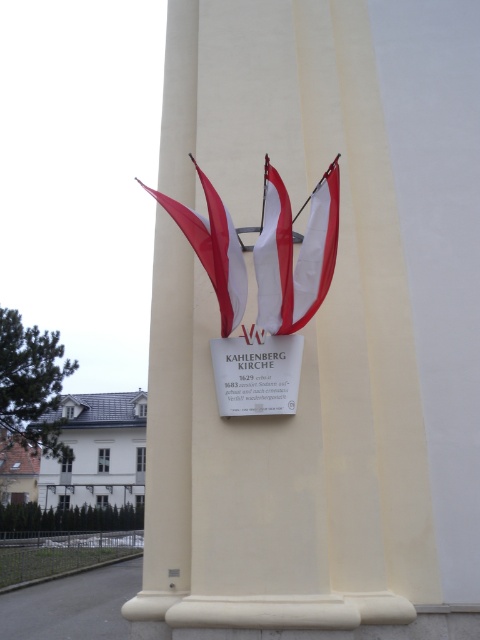
Question: Is white matte plaque at center to the right of white matte flag at center from the viewer's perspective?

Choices:
 (A) no
 (B) yes

Answer: (A)

Question: Considering the real-world distances, which object is farthest from the white/red striped flag at center?

Choices:
 (A) red fabric flag at center
 (B) white matte flag at center

Answer: (A)

Question: Is white smooth pillar at center in front of red fabric flag at center?

Choices:
 (A) yes
 (B) no

Answer: (A)

Question: Is the position of red fabric flag at center less distant than that of white/red striped flag at center?

Choices:
 (A) yes
 (B) no

Answer: (B)

Question: Considering the real-world distances, which object is farthest from the white matte flag at center?

Choices:
 (A) white matte plaque at center
 (B) red fabric flag at center

Answer: (B)

Question: Estimate the real-world distances between objects in this image. Which object is farther from the white smooth pillar at center?

Choices:
 (A) red fabric flag at center
 (B) white matte plaque at center

Answer: (A)